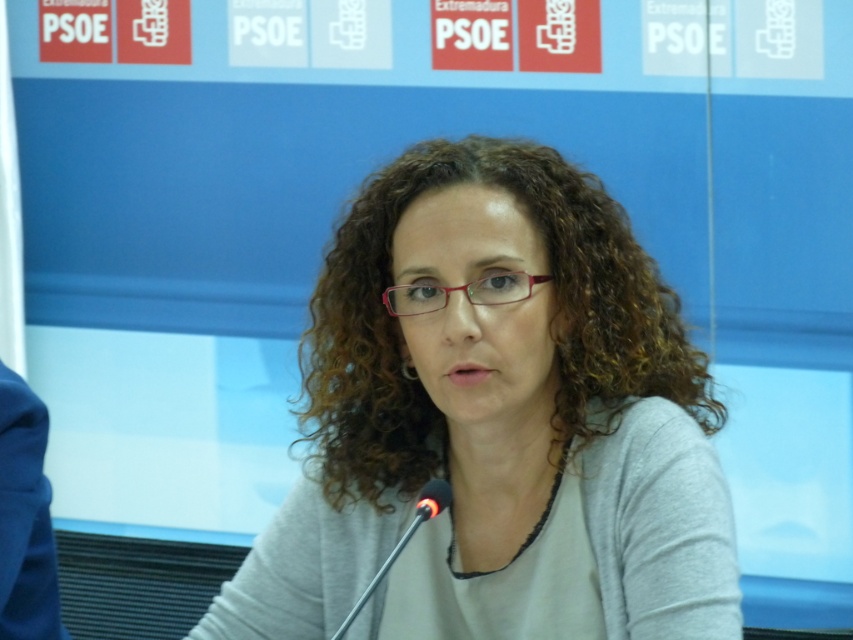
Question: Among these points, which one is farthest from the camera?

Choices:
 (A) (613, 417)
 (B) (444, 497)

Answer: (A)

Question: Can you confirm if gray matte sweater at center is bigger than black plastic microphone at center?

Choices:
 (A) yes
 (B) no

Answer: (A)

Question: Which point appears closest to the camera in this image?

Choices:
 (A) (428, 490)
 (B) (444, 352)

Answer: (B)

Question: Does gray matte sweater at center lie behind black plastic microphone at center?

Choices:
 (A) yes
 (B) no

Answer: (B)

Question: Can you confirm if gray matte sweater at center is wider than black plastic microphone at center?

Choices:
 (A) yes
 (B) no

Answer: (A)